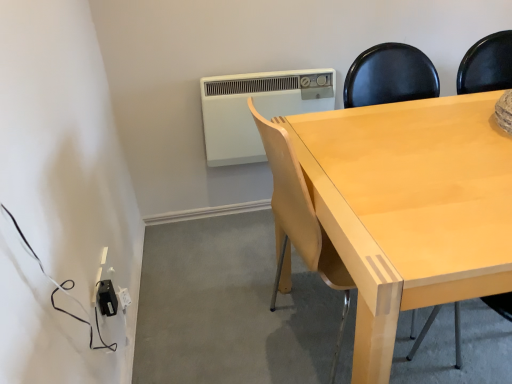
Question: Is light wood chair at center to the left of black plastic outlet at lower left from the viewer's perspective?

Choices:
 (A) no
 (B) yes

Answer: (A)

Question: Can you confirm if light wood chair at center is smaller than black plastic outlet at lower left?

Choices:
 (A) yes
 (B) no

Answer: (B)

Question: From a real-world perspective, is light wood chair at center physically above black plastic outlet at lower left?

Choices:
 (A) no
 (B) yes

Answer: (B)

Question: Is there a large distance between light wood chair at center and black plastic outlet at lower left?

Choices:
 (A) no
 (B) yes

Answer: (A)

Question: Is the depth of light wood chair at center less than that of black plastic outlet at lower left?

Choices:
 (A) yes
 (B) no

Answer: (A)

Question: Is light wood chair at center behind black plastic outlet at lower left?

Choices:
 (A) no
 (B) yes

Answer: (A)

Question: Is light wood chair at center closer to the viewer compared to white plastic air conditioner at upper center?

Choices:
 (A) yes
 (B) no

Answer: (A)

Question: Is light wood chair at center to the left of white plastic air conditioner at upper center from the viewer's perspective?

Choices:
 (A) no
 (B) yes

Answer: (A)

Question: From a real-world perspective, is light wood chair at center physically above white plastic air conditioner at upper center?

Choices:
 (A) no
 (B) yes

Answer: (A)

Question: Does light wood chair at center have a smaller size compared to white plastic air conditioner at upper center?

Choices:
 (A) yes
 (B) no

Answer: (B)

Question: Is white plastic air conditioner at upper center a part of light wood chair at center?

Choices:
 (A) no
 (B) yes

Answer: (A)

Question: Is light wood chair at center wider than white plastic air conditioner at upper center?

Choices:
 (A) no
 (B) yes

Answer: (B)

Question: Is black plastic outlet at lower left outside of light wood chair at center?

Choices:
 (A) no
 (B) yes

Answer: (B)